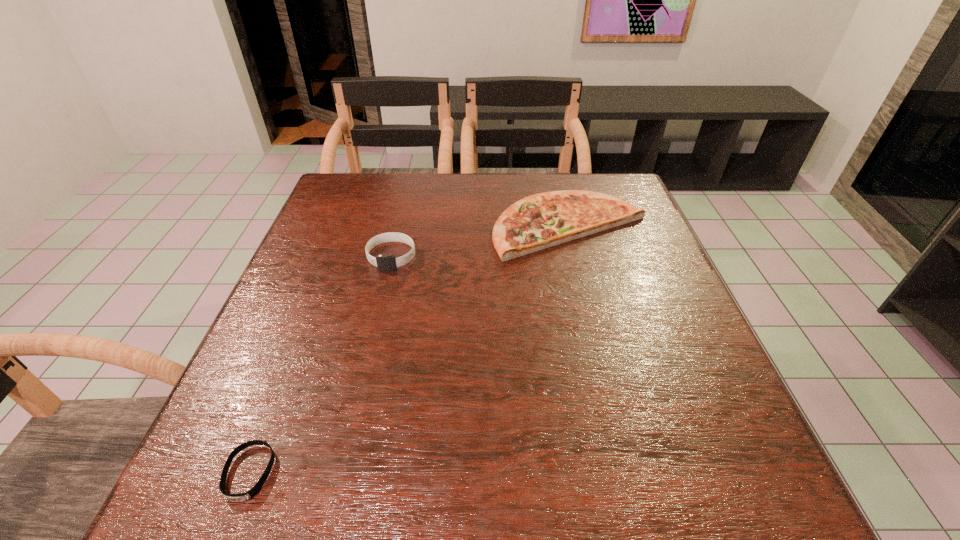
Locate which object is the second closest to the pizza. Please provide its 2D coordinates. Your answer should be formatted as a tuple, i.e. [(x, y)], where the tuple contains the x and y coordinates of a point satisfying the conditions above.

[(254, 491)]